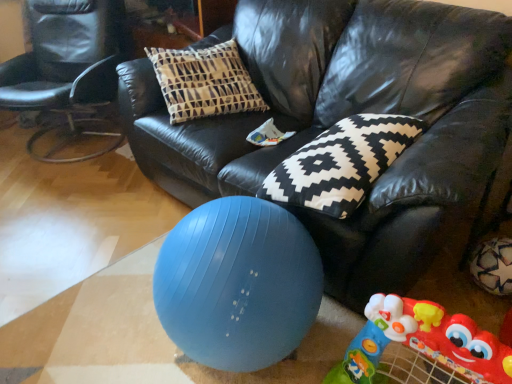
Locate an element on the screen. This screenshot has height=384, width=512. vacant area situated to the left side of blue rubber ball at lower center is located at coordinates (103, 323).